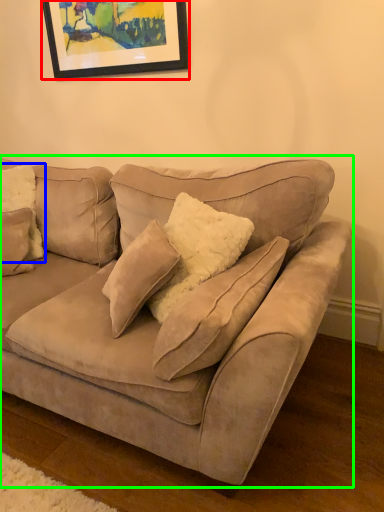
Question: Based on their relative distances, which object is nearer to picture frame (highlighted by a red box)? Choose from pillow (highlighted by a blue box) and studio couch (highlighted by a green box).

Choices:
 (A) pillow
 (B) studio couch

Answer: (A)